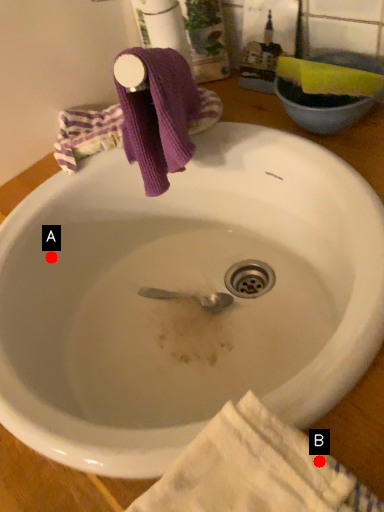
Question: Two points are circled on the image, labeled by A and B beside each circle. Which point is closer to the camera?

Choices:
 (A) A is closer
 (B) B is closer

Answer: (B)